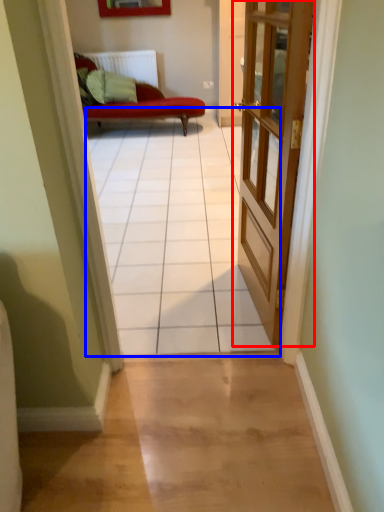
Question: Which of the following is the farthest to the observer, door (highlighted by a red box) or path (highlighted by a blue box)?

Choices:
 (A) door
 (B) path

Answer: (A)